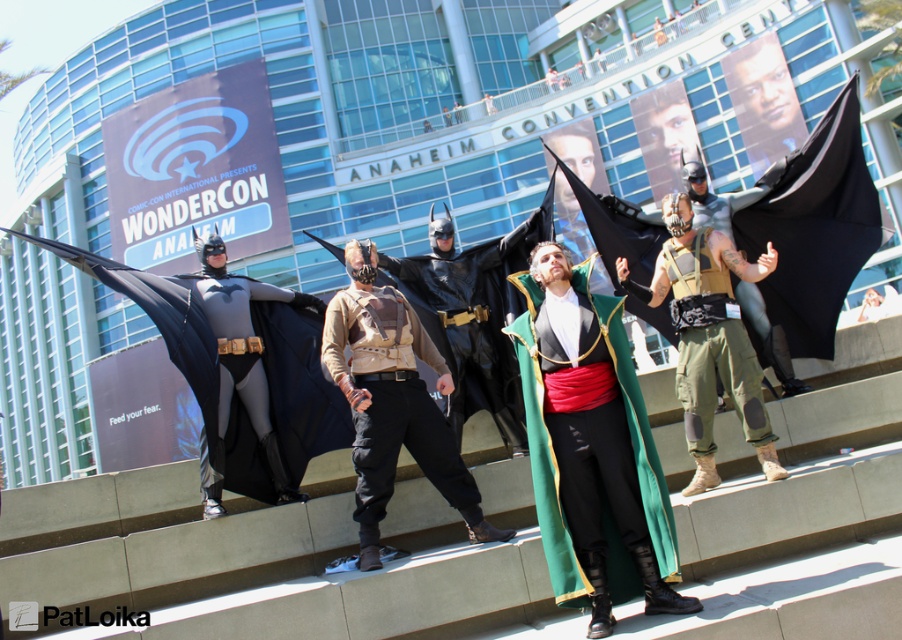
Who is shorter, tan leather vest at center or tan/canvas vest at center?

With less height is tan/canvas vest at center.

Between tan leather vest at center and tan/canvas vest at center, which one has more height?

tan leather vest at center

Does point (370, 404) come closer to viewer compared to point (719, 340)?

Yes, point (370, 404) is closer to viewer.

Find the location of a particular element. tan leather vest at center is located at coordinates (392, 401).

Who is more forward, (x=585, y=292) or (x=723, y=264)?

Positioned in front is point (x=585, y=292).

Can you confirm if green velvet cape at center is positioned below tan/canvas vest at center?

Indeed, green velvet cape at center is positioned under tan/canvas vest at center.

Which is in front, point (576, 577) or point (707, 381)?

Point (576, 577) is in front.

Locate an element on the screen. Image resolution: width=902 pixels, height=640 pixels. green velvet cape at center is located at coordinates (544, 458).

Which is below, tan leather vest at center or green velvet cape at center?

Positioned lower is green velvet cape at center.

Is point (378, 371) farther from camera compared to point (620, 344)?

Yes.

Who is more forward, [405,404] or [610,518]?

Point [610,518] is in front.

The width and height of the screenshot is (902, 640). I want to click on tan leather vest at center, so click(x=392, y=401).